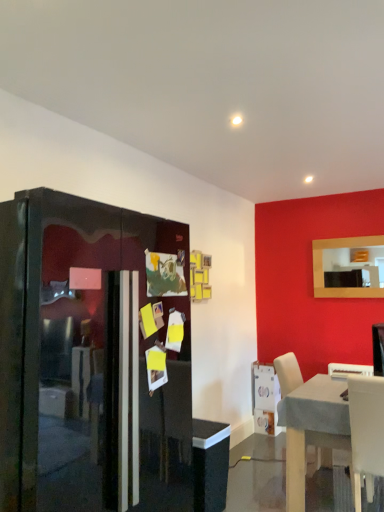
Locate an element on the screen. free space above matte wooden mirror at upper right (from a real-world perspective) is located at coordinates (342, 239).